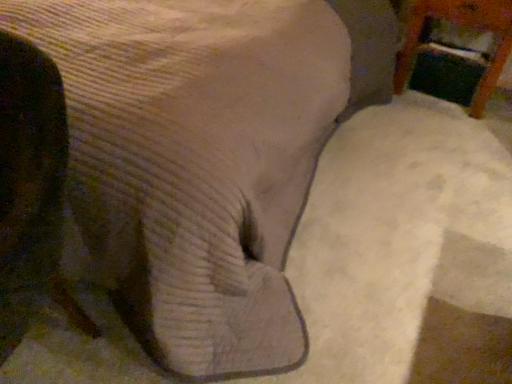
The height and width of the screenshot is (384, 512). Find the location of `wooden chair at upper right`. wooden chair at upper right is located at coordinates (465, 26).

What is the approximate width of wooden chair at upper right?

wooden chair at upper right is 18.92 inches wide.

The width and height of the screenshot is (512, 384). What do you see at coordinates (465, 26) in the screenshot? I see `wooden chair at upper right` at bounding box center [465, 26].

Identify the location of wooden chair at upper right. This screenshot has height=384, width=512. (465, 26).